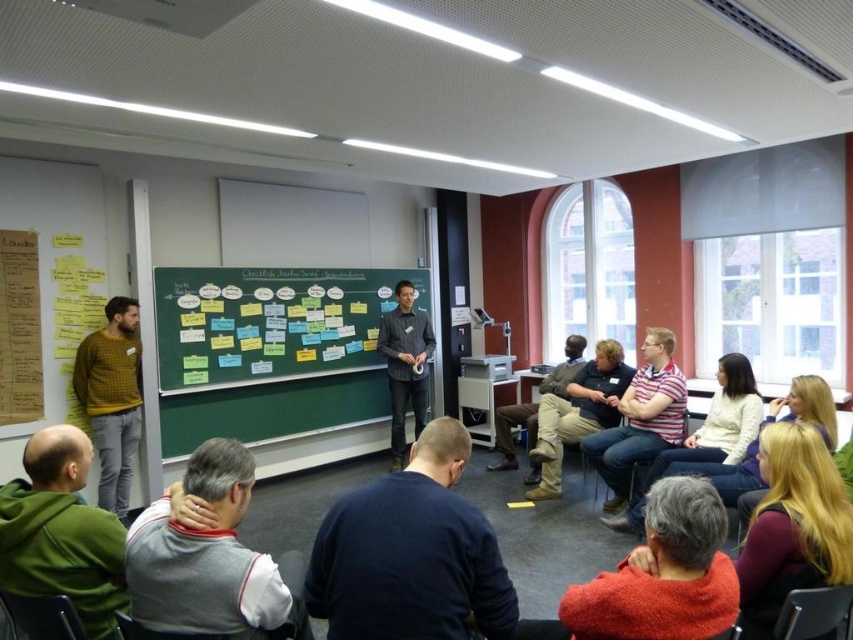
Question: Does green chalkboard at center have a greater width compared to khaki corduroy pants at center?

Choices:
 (A) no
 (B) yes

Answer: (B)

Question: Considering the relative positions of dark blue sweater at lower center and metallic silver chair at lower right in the image provided, where is dark blue sweater at lower center located with respect to metallic silver chair at lower right?

Choices:
 (A) left
 (B) right

Answer: (A)

Question: Estimate the real-world distances between objects in this image. Which object is closer to the green fabric chair at lower left?

Choices:
 (A) white fabric chair at lower center
 (B) green chalkboard at center
 (C) matte black chair at center

Answer: (A)

Question: In this image, where is gray fleece jacket at lower left located relative to white fabric chair at lower center?

Choices:
 (A) left
 (B) right

Answer: (A)

Question: Which of the following is the closest to the observer?

Choices:
 (A) (236, 564)
 (B) (343, 346)
 (C) (596, 355)
 (D) (119, 557)

Answer: (A)

Question: Which point is closer to the camera?

Choices:
 (A) (109, 445)
 (B) (279, 561)
 (C) (788, 604)

Answer: (C)